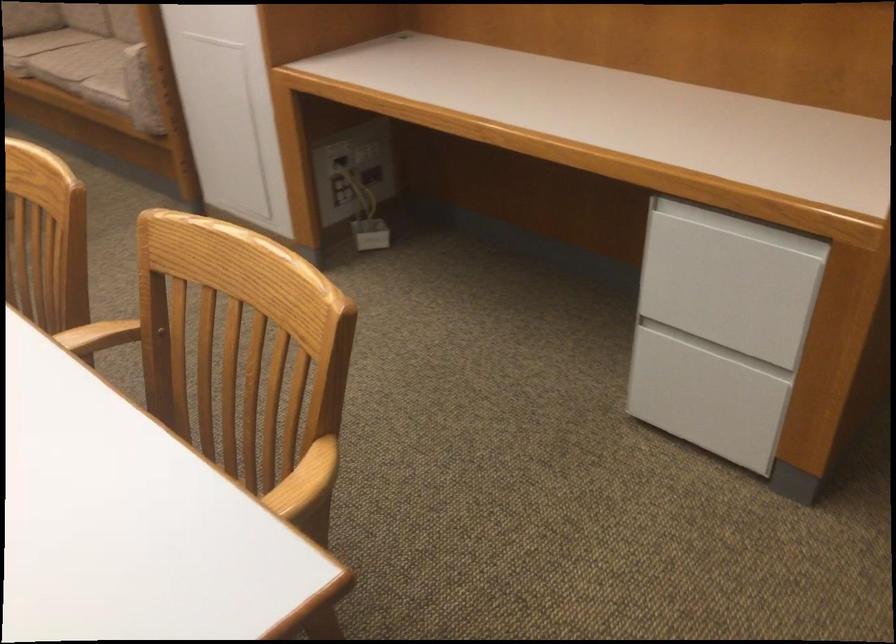
Find where to sit the sofa sitting surface. Please return your answer as a coordinate pair (x, y).

(76, 61)